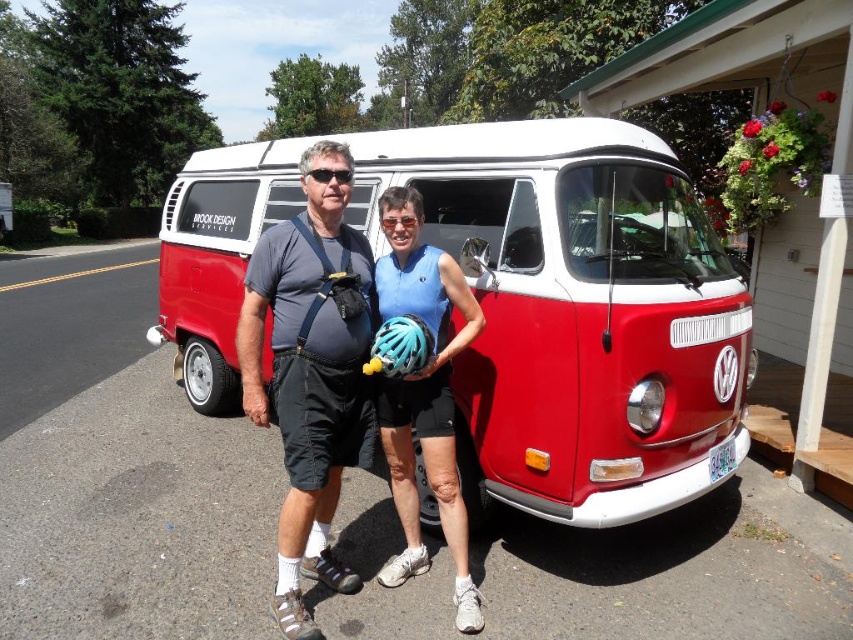
Question: Which is nearer to the blue matte helmet at center?

Choices:
 (A) teal matte bicycle helmet at center
 (B) red matte van at center

Answer: (A)

Question: Can you confirm if blue matte helmet at center is thinner than teal matte bicycle helmet at center?

Choices:
 (A) yes
 (B) no

Answer: (B)

Question: Estimate the real-world distances between objects in this image. Which object is closer to the matte black helmet at center?

Choices:
 (A) blue matte helmet at center
 (B) red matte van at center

Answer: (A)

Question: Can you confirm if matte black helmet at center is smaller than teal matte bicycle helmet at center?

Choices:
 (A) no
 (B) yes

Answer: (A)

Question: Among these objects, which one is farthest from the camera?

Choices:
 (A) teal matte bicycle helmet at center
 (B) blue matte helmet at center
 (C) matte black helmet at center

Answer: (B)

Question: Is matte black helmet at center bigger than blue matte helmet at center?

Choices:
 (A) yes
 (B) no

Answer: (A)